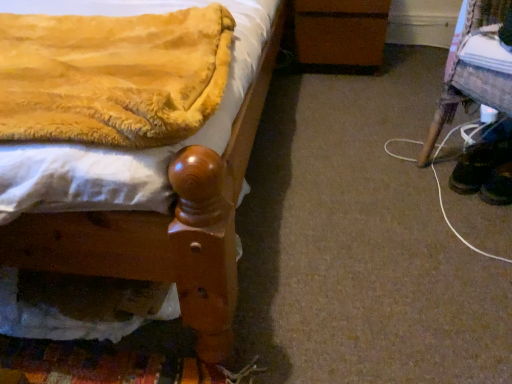
Question: Would you say black suede shoes at lower right, which is the 2th footwear in left-to-right order, is to the left or to the right of brown wooden changing table at center in the picture?

Choices:
 (A) left
 (B) right

Answer: (B)

Question: From a real-world perspective, is black suede shoes at lower right, which is the 2th footwear in left-to-right order, physically located above or below brown wooden changing table at center?

Choices:
 (A) below
 (B) above

Answer: (A)

Question: Which is nearer to the wooden stool at lower right?

Choices:
 (A) black leather shoes at lower right, acting as the 2th footwear starting from the right
 (B) black suede shoes at lower right, the first footwear when ordered from right to left
 (C) velvet yellow blanket at upper left
 (D) brown wooden changing table at center
 (E) wooden bedpost at left

Answer: (A)

Question: Considering the real-world distances, which object is closest to the black suede shoes at lower right, which is the 2th footwear in left-to-right order?

Choices:
 (A) velvet yellow blanket at upper left
 (B) wooden bedpost at left
 (C) brown wooden changing table at center
 (D) wooden stool at lower right
 (E) black leather shoes at lower right, which ranks as the first footwear in left-to-right order

Answer: (E)